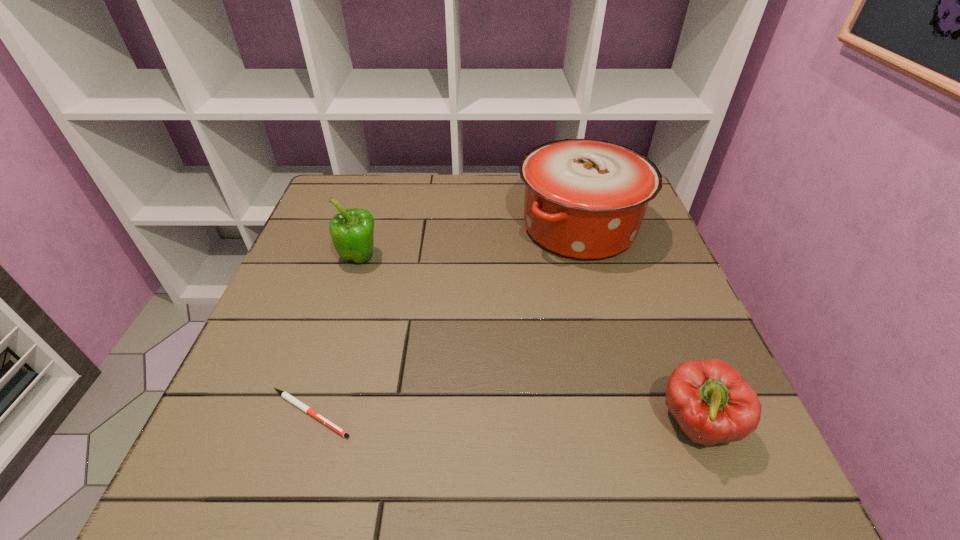
This screenshot has width=960, height=540. Find the location of `object located in the far edge section of the desktop`. object located in the far edge section of the desktop is located at coordinates (585, 199).

Where is `object at the near edge`? The image size is (960, 540). object at the near edge is located at coordinates (709, 399).

Locate an element on the screen. The image size is (960, 540). bell pepper that is at the left edge is located at coordinates (351, 230).

Locate an element on the screen. pen that is at the left edge is located at coordinates (285, 395).

Find the location of a particular element. The width and height of the screenshot is (960, 540). casserole that is at the right edge is located at coordinates (585, 199).

You are a GUI agent. You are given a task and a screenshot of the screen. Output one action in this format:
    pyautogui.click(x=<x>, y=<y>)
    Task: Click on the bell pepper that is at the right edge
    
    Given the screenshot: What is the action you would take?
    pyautogui.click(x=709, y=399)

This screenshot has width=960, height=540. I want to click on object at the far right corner, so click(585, 199).

At what (x,y) coordinates should I click in order to perform the action: click on object that is at the near right corner. Please return your answer as a coordinate pair (x, y). The height and width of the screenshot is (540, 960). Looking at the image, I should click on click(x=709, y=399).

At what (x,y) coordinates should I click in order to perform the action: click on vacant space at the far edge. Please return your answer as a coordinate pair (x, y). This screenshot has height=540, width=960. Looking at the image, I should click on (517, 180).

Locate an element on the screen. The width and height of the screenshot is (960, 540). vacant space at the near edge of the desktop is located at coordinates (507, 498).